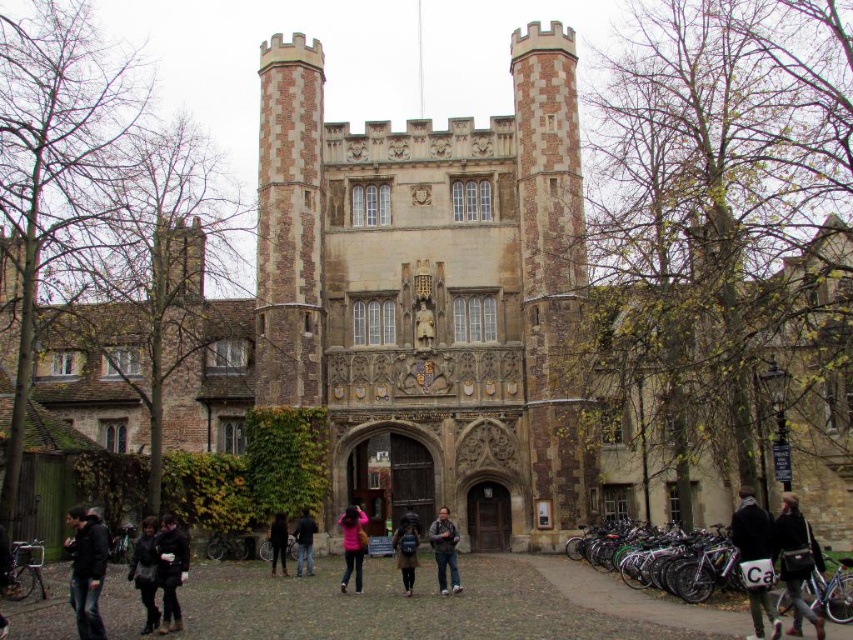
Question: Can you confirm if dark gray jacket at lower left is smaller than pink fabric at center?

Choices:
 (A) yes
 (B) no

Answer: (B)

Question: Estimate the real-world distances between objects in this image. Which object is closer to the brown fuzzy coat at center?

Choices:
 (A) dark brown leather jacket at lower left
 (B) black leather coat at lower left
 (C) brown stone tower at center
 (D) black fabric pants at lower center

Answer: (D)

Question: Can you confirm if dark brown leather jacket at lower right is positioned above black fabric pants at lower center?

Choices:
 (A) yes
 (B) no

Answer: (B)

Question: Which point is closer to the camera?

Choices:
 (A) (183, 548)
 (B) (146, 588)
 (C) (408, 564)
 (D) (397, 134)

Answer: (B)

Question: Which object is positioned farthest from the dark gray jacket at lower left?

Choices:
 (A) black leather coat at lower left
 (B) dark gray fabric jacket at lower right
 (C) black leather jacket at center

Answer: (B)

Question: Is dark gray fabric jacket at lower right to the left of brown fuzzy coat at center from the viewer's perspective?

Choices:
 (A) no
 (B) yes

Answer: (A)